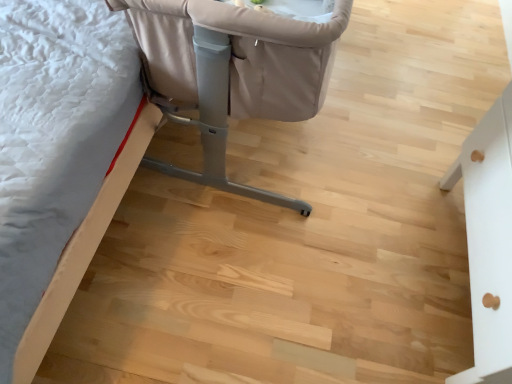
Question: From a real-world perspective, is beige fabric crib at upper center, arranged as the second furniture when viewed from the left, positioned over beige fabric crib at upper left, the 3th furniture in the right-to-left sequence, based on gravity?

Choices:
 (A) yes
 (B) no

Answer: (A)

Question: Is beige fabric crib at upper center, arranged as the second furniture when viewed from the left, not within beige fabric crib at upper left, the 3th furniture in the right-to-left sequence?

Choices:
 (A) no
 (B) yes

Answer: (B)

Question: From the image's perspective, would you say beige fabric crib at upper center, arranged as the second furniture when viewed from the left, is shown under beige fabric crib at upper left, the 3th furniture in the right-to-left sequence?

Choices:
 (A) no
 (B) yes

Answer: (A)

Question: Would you consider beige fabric crib at upper center, the second furniture from the right, to be distant from beige fabric crib at upper left, which is counted as the first furniture, starting from the left?

Choices:
 (A) no
 (B) yes

Answer: (A)

Question: Can you confirm if beige fabric crib at upper center, the second furniture from the right, is taller than beige fabric crib at upper left, which is counted as the first furniture, starting from the left?

Choices:
 (A) yes
 (B) no

Answer: (A)

Question: Is beige fabric crib at upper center, the second furniture from the right, to the left or to the right of beige fabric crib at upper left, which is counted as the first furniture, starting from the left, in the image?

Choices:
 (A) left
 (B) right

Answer: (B)

Question: From the image's perspective, is beige fabric crib at upper center, the second furniture from the right, positioned above or below beige fabric crib at upper left, which is counted as the first furniture, starting from the left?

Choices:
 (A) below
 (B) above

Answer: (B)

Question: Based on their sizes in the image, would you say beige fabric crib at upper center, arranged as the second furniture when viewed from the left, is bigger or smaller than beige fabric crib at upper left, which is counted as the first furniture, starting from the left?

Choices:
 (A) big
 (B) small

Answer: (A)

Question: Is point [260, 193] closer or farther from the camera than point [168, 23]?

Choices:
 (A) farther
 (B) closer

Answer: (A)

Question: Is beige fabric crib at upper left, which is counted as the first furniture, starting from the left, wider or thinner than beige fabric crib at upper center, arranged as the second furniture when viewed from the left?

Choices:
 (A) wide
 (B) thin

Answer: (A)

Question: From a real-world perspective, is beige fabric crib at upper left, the 3th furniture in the right-to-left sequence, physically located above or below beige fabric crib at upper center, arranged as the second furniture when viewed from the left?

Choices:
 (A) below
 (B) above

Answer: (A)

Question: Considering the positions of point (10, 92) and point (231, 92), is point (10, 92) closer or farther from the camera than point (231, 92)?

Choices:
 (A) closer
 (B) farther

Answer: (A)

Question: In the image, is beige fabric crib at upper left, the 3th furniture in the right-to-left sequence, positioned in front of or behind beige fabric crib at upper center, the second furniture from the right?

Choices:
 (A) behind
 (B) front

Answer: (A)

Question: Relative to white matte drawer at right, which is counted as the first furniture, starting from the right, is beige fabric crib at upper left, which is counted as the first furniture, starting from the left, in front or behind?

Choices:
 (A) behind
 (B) front

Answer: (A)

Question: From a real-world perspective, relative to white matte drawer at right, which appears as the third furniture when viewed from the left, is beige fabric crib at upper left, which is counted as the first furniture, starting from the left, vertically above or below?

Choices:
 (A) below
 (B) above

Answer: (A)